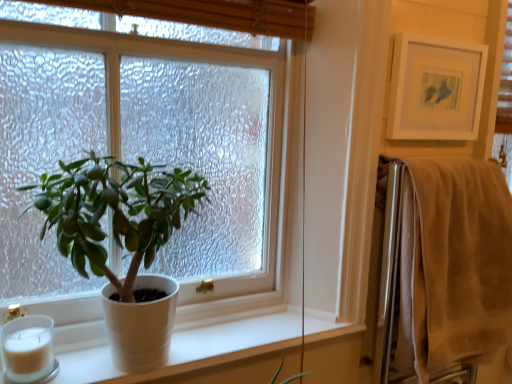
Question: Based on their sizes in the image, would you say white matte candle at lower left is bigger or smaller than white matte picture frame at upper right?

Choices:
 (A) small
 (B) big

Answer: (A)

Question: Is white matte candle at lower left wider or thinner than white matte picture frame at upper right?

Choices:
 (A) wide
 (B) thin

Answer: (A)

Question: Which of these objects is positioned farthest from the white matte picture frame at upper right?

Choices:
 (A) white matte window sill at lower left
 (B) white matte candle at lower left
 (C) white textured window at center
 (D) white matte pot at left
 (E) beige cotton towel at right

Answer: (B)

Question: Estimate the real-world distances between objects in this image. Which object is farther from the white matte window sill at lower left?

Choices:
 (A) white textured window at center
 (B) white matte pot at left
 (C) white matte picture frame at upper right
 (D) beige cotton towel at right
 (E) white matte candle at lower left

Answer: (C)